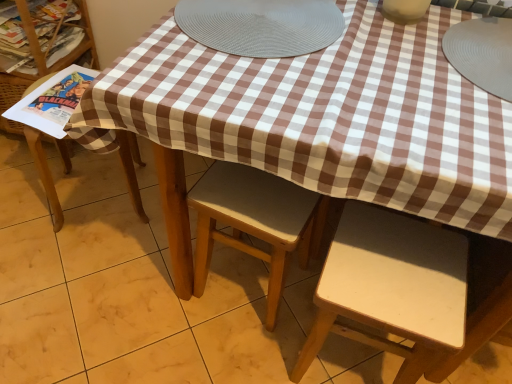
Find the location of a particular element. free space in front of light brown wood chair at center, which is counted as the 2th chair, starting from the right is located at coordinates (231, 349).